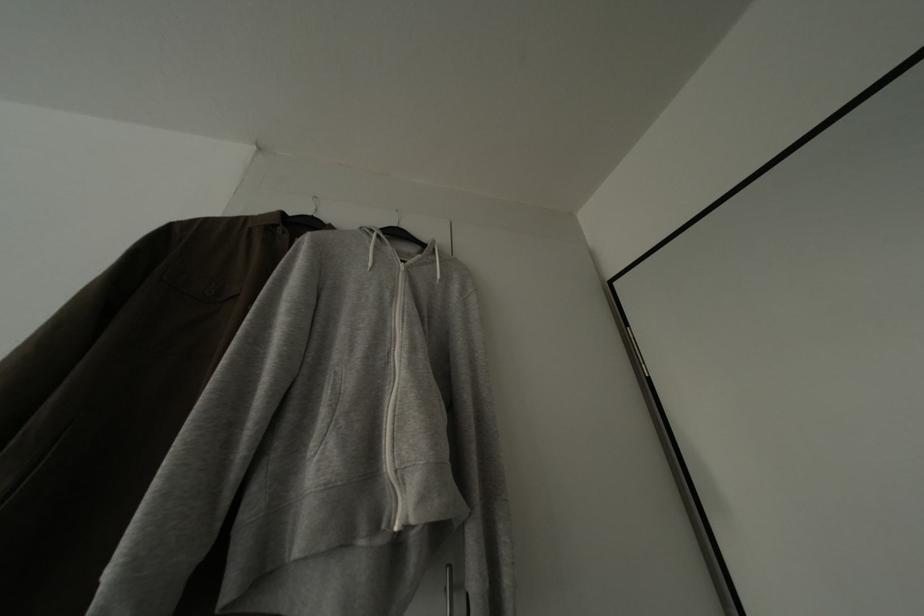
Where would you pull the white zipper pull? Please return your answer as a coordinate pair (x, y).

(397, 506)